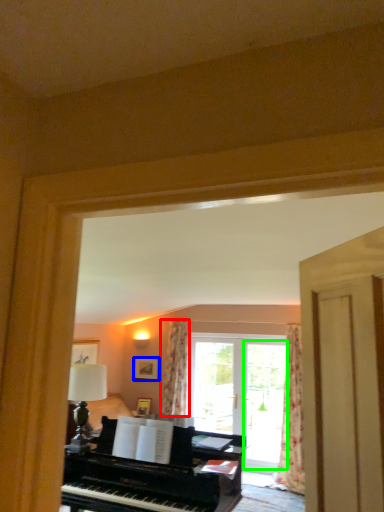
Question: Which is nearer to the curtain (highlighted by a red box)? picture frame (highlighted by a blue box) or screen door (highlighted by a green box).

Choices:
 (A) picture frame
 (B) screen door

Answer: (A)